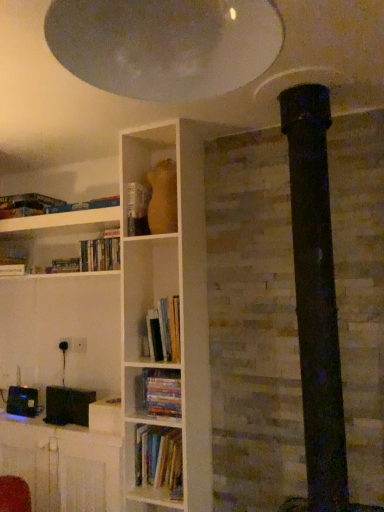
Question: Are hardcover books at center, positioned as the 2th book in bottom-to-top order, and black plastic table at lower left far apart?

Choices:
 (A) yes
 (B) no

Answer: (B)

Question: Is hardcover books at center, the 2th book from the top, positioned beyond the bounds of black plastic table at lower left?

Choices:
 (A) no
 (B) yes

Answer: (B)

Question: From the image's perspective, is hardcover books at center, positioned as the 2th book in bottom-to-top order, located beneath black plastic table at lower left?

Choices:
 (A) no
 (B) yes

Answer: (A)

Question: Is hardcover books at center, positioned as the 2th book in bottom-to-top order, at the right side of black plastic table at lower left?

Choices:
 (A) no
 (B) yes

Answer: (B)

Question: Is hardcover books at center, the 2th book from the top, bigger than black plastic table at lower left?

Choices:
 (A) no
 (B) yes

Answer: (A)

Question: Considering the positions of hardcover book at center and black plastic table at lower left in the image, is hardcover book at center wider or thinner than black plastic table at lower left?

Choices:
 (A) thin
 (B) wide

Answer: (A)

Question: In terms of size, does hardcover book at center appear bigger or smaller than black plastic table at lower left?

Choices:
 (A) small
 (B) big

Answer: (A)

Question: Is hardcover book at center in front of or behind black plastic table at lower left in the image?

Choices:
 (A) behind
 (B) front

Answer: (A)

Question: Visually, is hardcover book at center positioned to the left or to the right of black plastic table at lower left?

Choices:
 (A) right
 (B) left

Answer: (A)

Question: Is point (102, 266) closer or farther from the camera than point (173, 395)?

Choices:
 (A) farther
 (B) closer

Answer: (A)

Question: Which is correct: hardcover books at center, positioned as the 3th book in bottom-to-top order, is inside hardcover books at center, arranged as the first book when ordered from the bottom, or outside of it?

Choices:
 (A) inside
 (B) outside

Answer: (B)

Question: Is hardcover books at center, positioned as the 3th book in bottom-to-top order, bigger or smaller than hardcover books at center, arranged as the first book when ordered from the bottom?

Choices:
 (A) small
 (B) big

Answer: (B)

Question: From a real-world perspective, is hardcover books at center, which is the first book from top to bottom, above or below hardcover books at center, arranged as the first book when ordered from the bottom?

Choices:
 (A) above
 (B) below

Answer: (A)

Question: Considering the relative positions of black plastic table at lower left and white glossy exhaust hood at upper center in the image provided, is black plastic table at lower left to the left or to the right of white glossy exhaust hood at upper center?

Choices:
 (A) right
 (B) left

Answer: (B)

Question: Is black plastic table at lower left inside or outside of white glossy exhaust hood at upper center?

Choices:
 (A) outside
 (B) inside

Answer: (A)